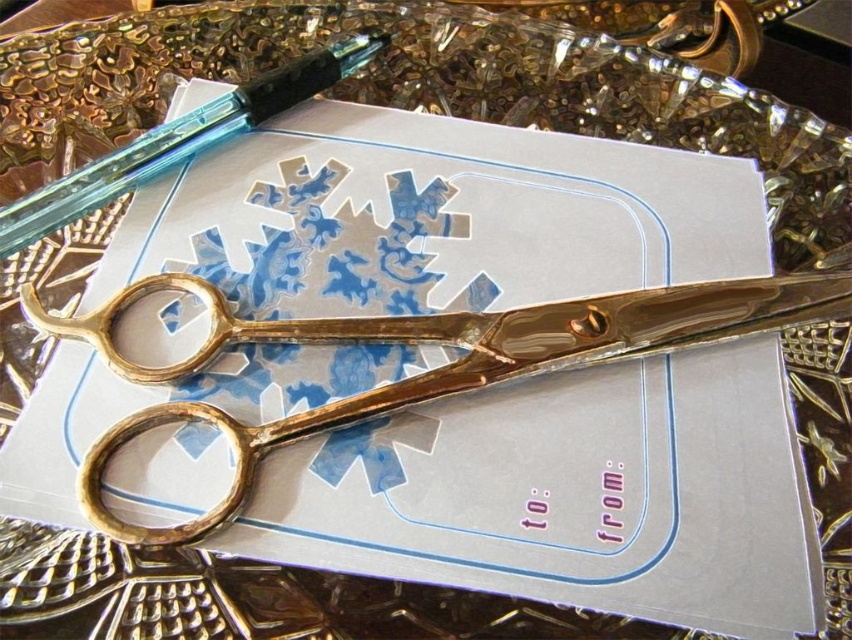
Question: Can you confirm if gold polished scissors at center is positioned to the right of translucent blue glass pen at upper left?

Choices:
 (A) yes
 (B) no

Answer: (A)

Question: Is gold polished scissors at center below translucent blue glass pen at upper left?

Choices:
 (A) yes
 (B) no

Answer: (A)

Question: Among these objects, which one is nearest to the camera?

Choices:
 (A) translucent blue glass pen at upper left
 (B) gold polished scissors at center

Answer: (B)

Question: Does gold polished scissors at center appear under translucent blue glass pen at upper left?

Choices:
 (A) yes
 (B) no

Answer: (A)